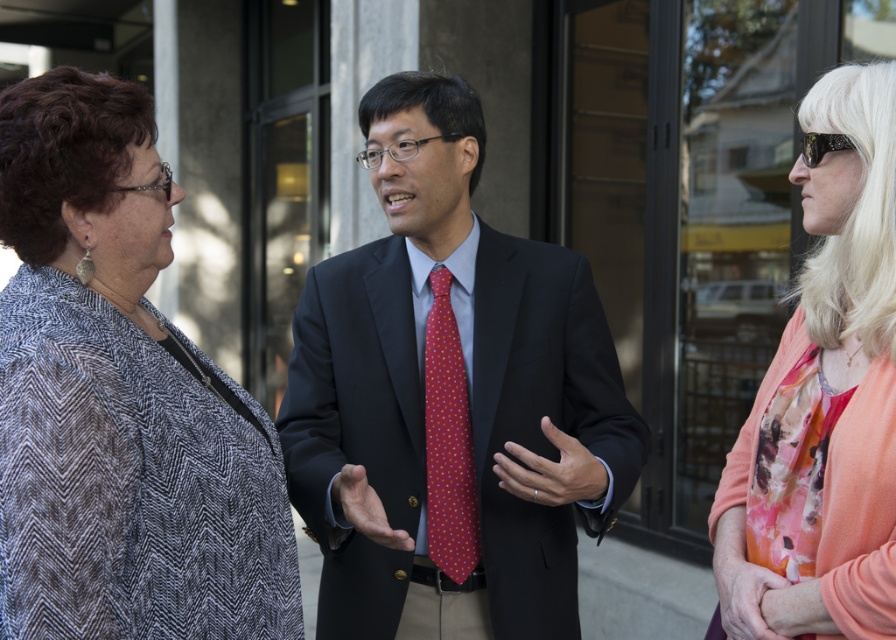
Question: Which object is the farthest from the polka dot silk tie at center?

Choices:
 (A) matte black suit at center
 (B) patterned fabric jacket at left
 (C) floral print blouse at center

Answer: (C)

Question: Which object appears closest to the camera in this image?

Choices:
 (A) patterned fabric jacket at left
 (B) matte black suit at center
 (C) floral print blouse at center
 (D) polka dot silk tie at center

Answer: (A)

Question: From the image, what is the correct spatial relationship of patterned fabric jacket at left in relation to polka dot silk tie at center?

Choices:
 (A) below
 (B) above

Answer: (B)

Question: Is the position of matte black suit at center less distant than that of floral print blouse at center?

Choices:
 (A) no
 (B) yes

Answer: (A)

Question: Is floral print blouse at center above polka dot silk tie at center?

Choices:
 (A) yes
 (B) no

Answer: (A)

Question: Which point appears closest to the camera in this image?

Choices:
 (A) (461, 406)
 (B) (454, 140)
 (C) (841, 170)

Answer: (C)